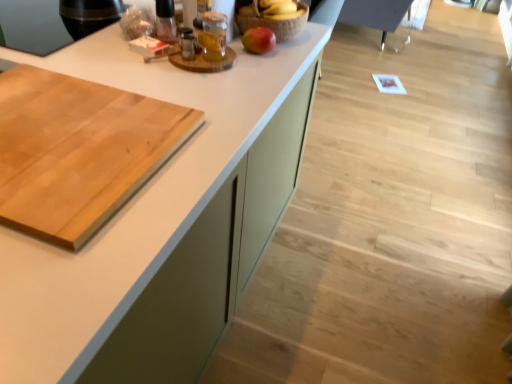
At what (x,y) coordinates should I click in order to perform the action: click on free spot in front of red matte apple at upper center. Please return your answer as a coordinate pair (x, y). Looking at the image, I should click on (258, 72).